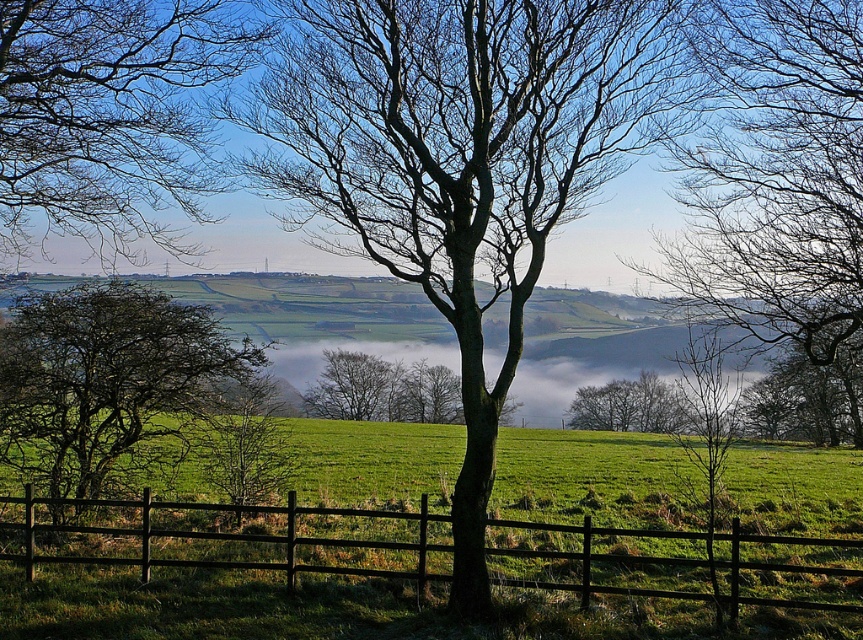
Is bare branches at upper center to the right of green leafy tree at left from the viewer's perspective?

Correct, you'll find bare branches at upper center to the right of green leafy tree at left.

Does bare branches at upper center appear over green leafy tree at left?

Indeed, bare branches at upper center is positioned over green leafy tree at left.

Who is more distant from viewer, (217,163) or (35,353)?

The point (35,353) is more distant.

Where is `bare branches at upper center`? This screenshot has width=863, height=640. bare branches at upper center is located at coordinates (111, 115).

Consider the image. Between bare branches at center and bare branches at upper center, which one has more height?

bare branches at center

Does bare branches at center have a smaller size compared to bare branches at upper center?

No.

Describe the element at coordinates (780, 202) in the screenshot. I see `bare branches at center` at that location.

Where is `bare branches at center`? bare branches at center is located at coordinates (780, 202).

Is brown wooden fence at center below green leafy tree at left?

Correct, brown wooden fence at center is located below green leafy tree at left.

Which is more to the right, brown wooden fence at center or green leafy tree at left?

brown wooden fence at center is more to the right.

Where is `brown wooden fence at center`? Image resolution: width=863 pixels, height=640 pixels. brown wooden fence at center is located at coordinates (228, 538).